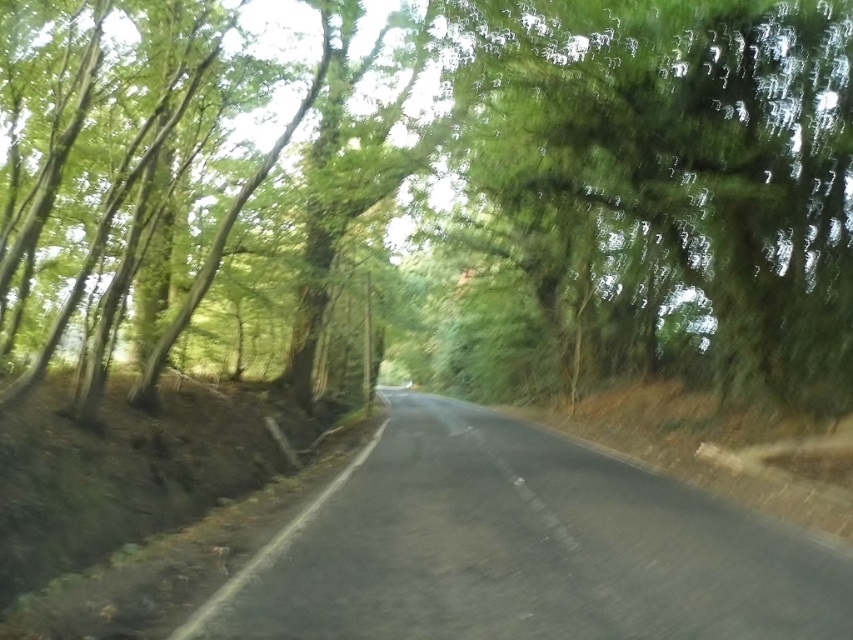
Question: Which of the following is the farthest from the observer?

Choices:
 (A) (636, 122)
 (B) (688, 564)

Answer: (A)

Question: Can you confirm if green leafy tree at center is positioned to the left of green leafy tree at upper center?

Choices:
 (A) no
 (B) yes

Answer: (B)

Question: Among these objects, which one is farthest from the camera?

Choices:
 (A) green leafy tree at upper center
 (B) green leafy tree at center
 (C) black asphalt road at center

Answer: (B)

Question: Which of the following is the closest to the observer?

Choices:
 (A) green leafy tree at upper center
 (B) black asphalt road at center

Answer: (B)

Question: Is green leafy tree at center wider than green leafy tree at upper center?

Choices:
 (A) yes
 (B) no

Answer: (A)

Question: Does green leafy tree at upper center appear on the left side of black asphalt road at center?

Choices:
 (A) yes
 (B) no

Answer: (B)